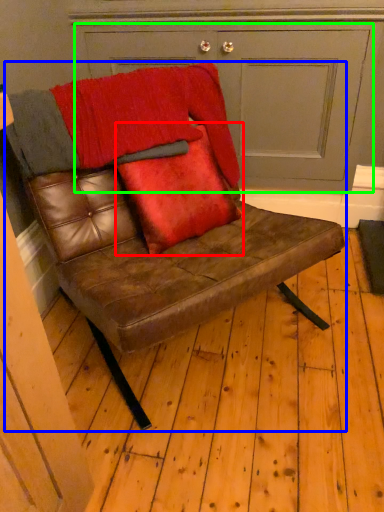
Question: Based on their relative distances, which object is nearer to throw pillow (highlighted by a red box)? Choose from chair (highlighted by a blue box) and door (highlighted by a green box).

Choices:
 (A) chair
 (B) door

Answer: (A)